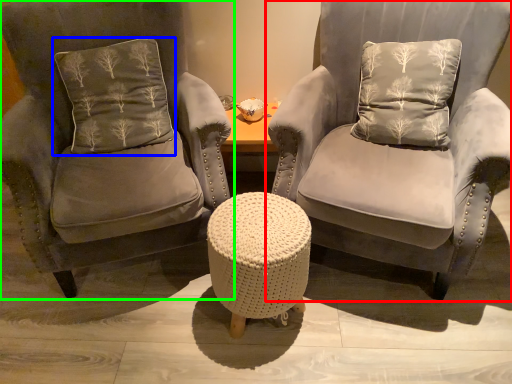
Question: Estimate the real-world distances between objects in this image. Which object is farther from chair (highlighted by a red box), pillow (highlighted by a blue box) or chair (highlighted by a green box)?

Choices:
 (A) pillow
 (B) chair

Answer: (A)